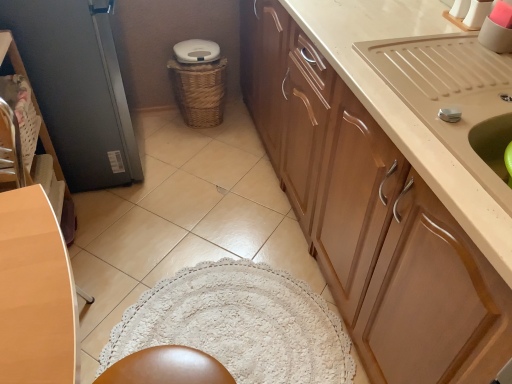
In order to click on free space on the front side of woven brown basket at center in this screenshot , I will do `click(199, 145)`.